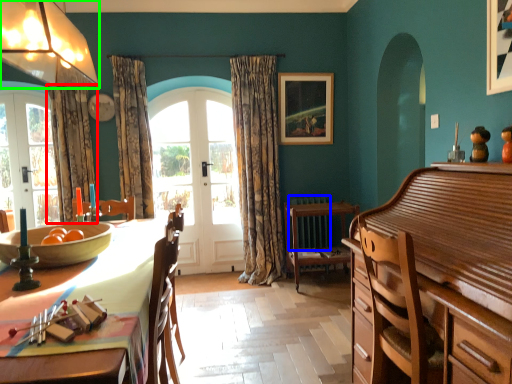
Question: Considering the real-world distances, which object is farthest from curtain (highlighted by a red box)? radiator (highlighted by a blue box) or lamp (highlighted by a green box)?

Choices:
 (A) radiator
 (B) lamp

Answer: (A)